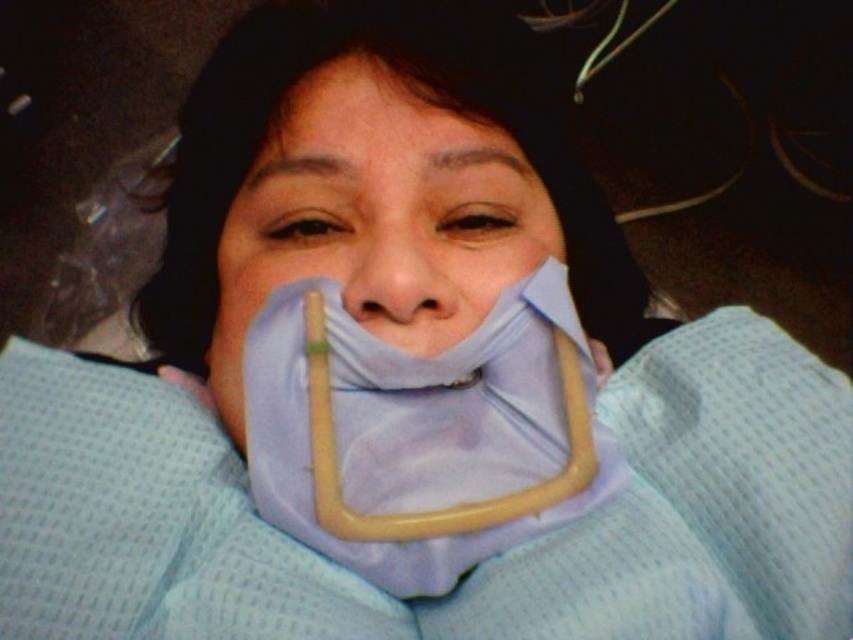
Who is taller, blue fabric mask at center or matte blue fabric at center?

blue fabric mask at center

Which of these two, blue fabric mask at center or matte blue fabric at center, stands shorter?

matte blue fabric at center

Where is `blue fabric mask at center`? blue fabric mask at center is located at coordinates (376, 218).

Does light blue fabric at center have a lesser height compared to matte blue fabric at center?

No, light blue fabric at center is not shorter than matte blue fabric at center.

Is light blue fabric at center taller than matte blue fabric at center?

Correct, light blue fabric at center is much taller as matte blue fabric at center.

Between point (498, 444) and point (376, 216), which one is positioned in front?

Point (498, 444)

Where is `light blue fabric at center`? This screenshot has width=853, height=640. light blue fabric at center is located at coordinates (422, 433).

Describe the element at coordinates (422, 433) in the screenshot. I see `light blue fabric at center` at that location.

Does light blue fabric at center have a lesser height compared to blue fabric mask at center?

Yes, light blue fabric at center is shorter than blue fabric mask at center.

Image resolution: width=853 pixels, height=640 pixels. In order to click on light blue fabric at center in this screenshot , I will do `click(422, 433)`.

The image size is (853, 640). Find the location of `light blue fabric at center`. light blue fabric at center is located at coordinates (422, 433).